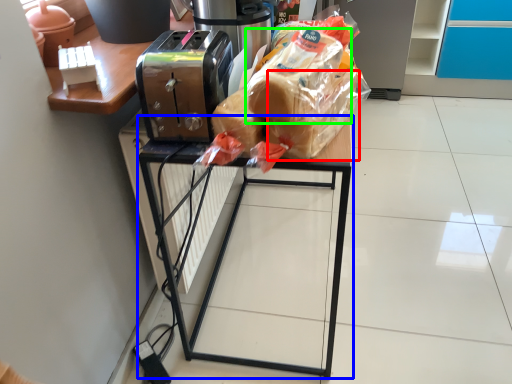
Question: Considering the real-world distances, which object is farthest from bread (highlighted by a red box)? furniture (highlighted by a blue box) or bread (highlighted by a green box)?

Choices:
 (A) furniture
 (B) bread

Answer: (A)